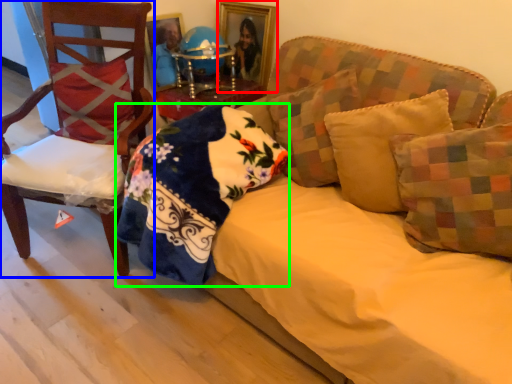
Question: Estimate the real-world distances between objects in this image. Which object is closer to picture frame (highlighted by a red box), chair (highlighted by a blue box) or material (highlighted by a green box)?

Choices:
 (A) chair
 (B) material

Answer: (A)